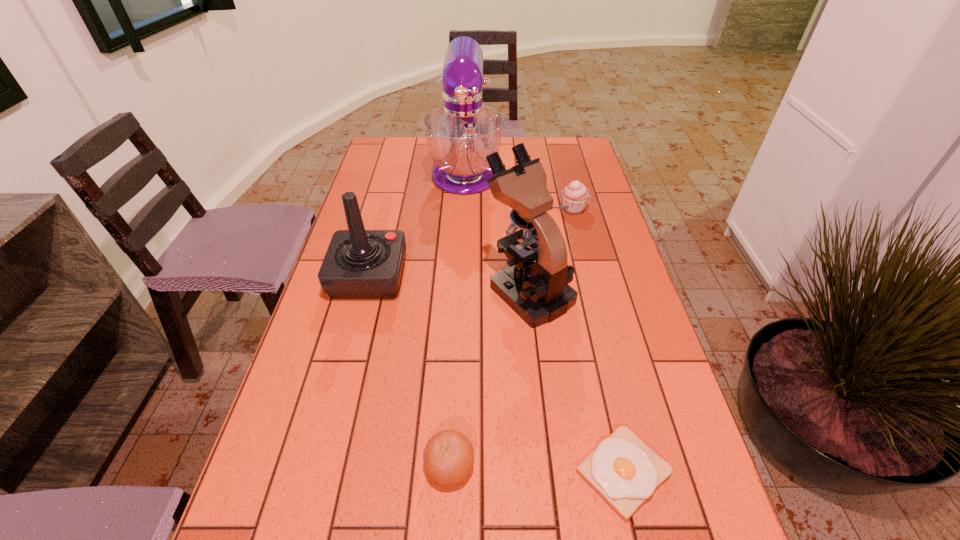
Find the location of a particular element. mixer is located at coordinates (460, 134).

You are a GUI agent. You are given a task and a screenshot of the screen. Output one action in this format:
    pyautogui.click(x=<x>, y=<y>)
    Task: Click on the microscope
    
    Given the screenshot: What is the action you would take?
    pyautogui.click(x=534, y=284)

Image resolution: width=960 pixels, height=540 pixels. In order to click on the leftmost object in this screenshot , I will do `click(359, 264)`.

Where is `joystick`? joystick is located at coordinates (359, 264).

You are a GUI agent. You are given a task and a screenshot of the screen. Output one action in this format:
    pyautogui.click(x=<x>, y=<y>)
    Task: Click on the fourth tallest object
    The height and width of the screenshot is (540, 960).
    Given the screenshot: What is the action you would take?
    pyautogui.click(x=575, y=195)

What are the coordinates of `the second shortest object` in the screenshot? It's located at (448, 456).

Locate an element on the screen. This screenshot has width=960, height=540. toast is located at coordinates (624, 471).

This screenshot has height=540, width=960. I want to click on vacant area situated 0.380m at the bowl opening of the mixer, so click(x=460, y=282).

In order to click on vacant space located on the back of the microscope in this screenshot , I will do `click(518, 197)`.

You are a GUI agent. You are given a task and a screenshot of the screen. Output one action in this format:
    pyautogui.click(x=<x>, y=<y>)
    Task: Click on the vacant area situated 0.400m on the front-facing side of the third tallest object
    The image size is (960, 540).
    Given the screenshot: What is the action you would take?
    pyautogui.click(x=553, y=276)